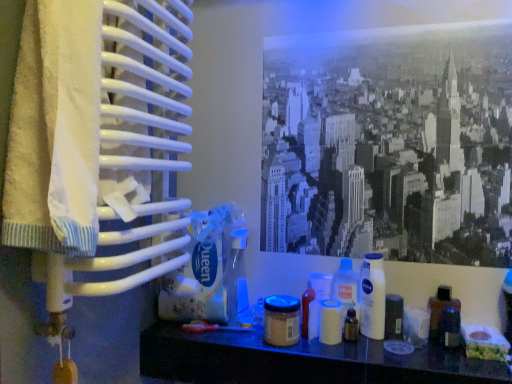
Locate an element on the screen. The height and width of the screenshot is (384, 512). free location to the right of brown matte jar at center, which appears as the second toiletry when viewed from the left is located at coordinates (347, 356).